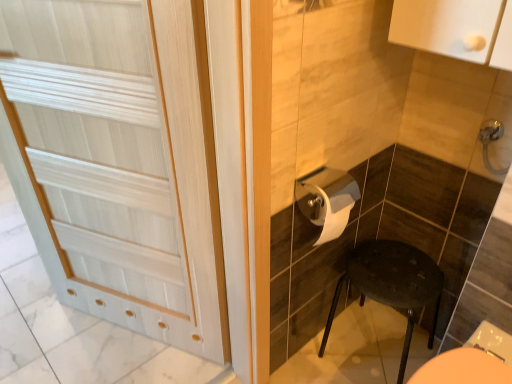
Question: Is white wood door at left taller or shorter than satin nickel faucet at upper right?

Choices:
 (A) tall
 (B) short

Answer: (A)

Question: From the image's perspective, is white wood door at left located above or below satin nickel faucet at upper right?

Choices:
 (A) above
 (B) below

Answer: (B)

Question: Considering the real-world distances, which object is closest to the white wood door at left?

Choices:
 (A) satin nickel faucet at upper right
 (B) matte black stool at lower right
 (C) white glossy toilet paper at center

Answer: (C)

Question: Considering the real-world distances, which object is closest to the white wood door at left?

Choices:
 (A) satin nickel faucet at upper right
 (B) matte black stool at lower right
 (C) white glossy toilet paper at center

Answer: (C)